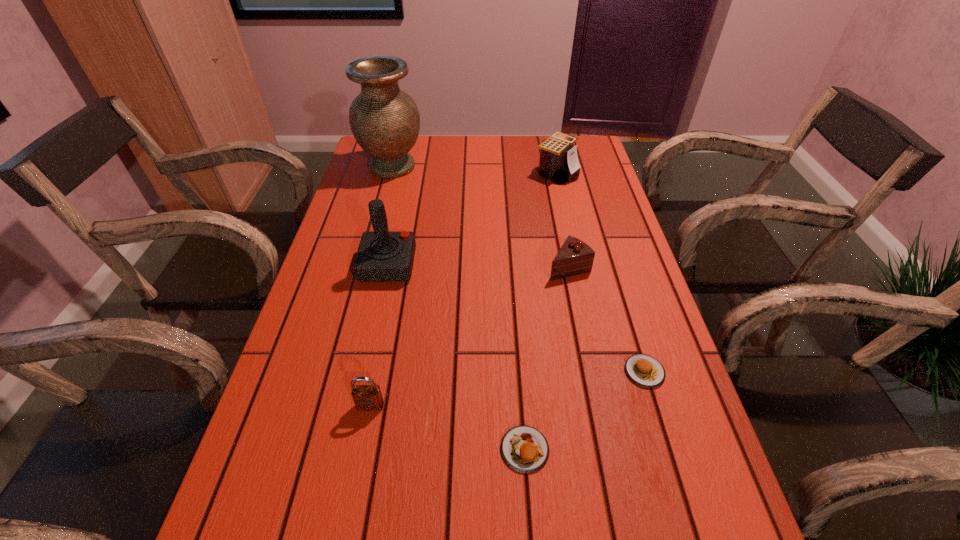
At what (x,y) coordinates should I click in order to perform the action: click on calculator that is positioned at the right edge. Please return your answer as a coordinate pair (x, y). The height and width of the screenshot is (540, 960). Looking at the image, I should click on (558, 162).

Image resolution: width=960 pixels, height=540 pixels. In order to click on chocolate cake that is at the right edge in this screenshot , I will do `click(575, 257)`.

The height and width of the screenshot is (540, 960). Find the location of `food that is at the right edge`. food that is at the right edge is located at coordinates (645, 370).

Identify the location of object located at the far left corner. The height and width of the screenshot is (540, 960). (384, 120).

At what (x,y) coordinates should I click in order to perform the action: click on object that is at the far right corner. Please return your answer as a coordinate pair (x, y). Image resolution: width=960 pixels, height=540 pixels. Looking at the image, I should click on (558, 162).

The width and height of the screenshot is (960, 540). I want to click on vacant space at the far edge of the desktop, so click(x=434, y=141).

The image size is (960, 540). In order to click on free space at the left edge in this screenshot , I will do `click(325, 271)`.

The image size is (960, 540). In the image, there is a desktop. Find the location of `vacant region at the right edge`. vacant region at the right edge is located at coordinates (684, 493).

Locate an element on the screen. This screenshot has width=960, height=540. blank space at the far left corner is located at coordinates (363, 168).

Identify the location of blank area at the far right corner. The image size is (960, 540). (599, 163).